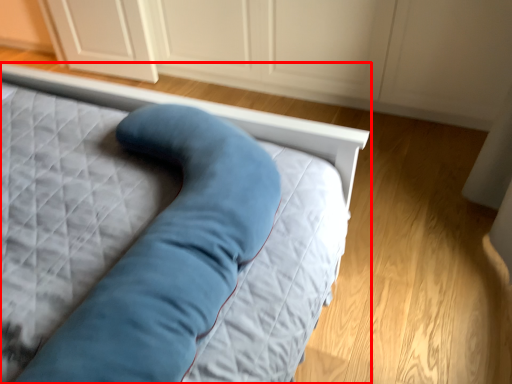
Question: Where is bed (annotated by the red box) located in relation to dresser in the image?

Choices:
 (A) right
 (B) left

Answer: (B)